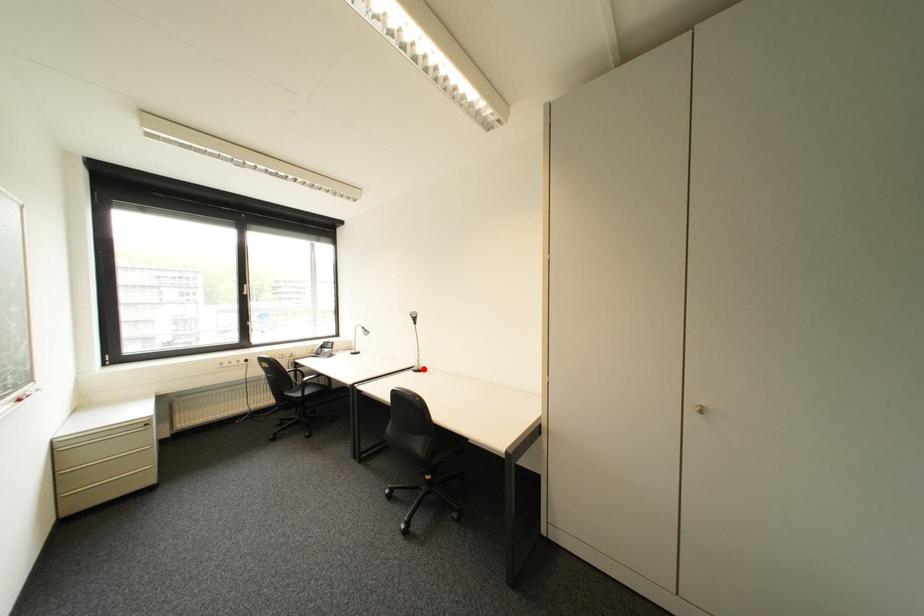
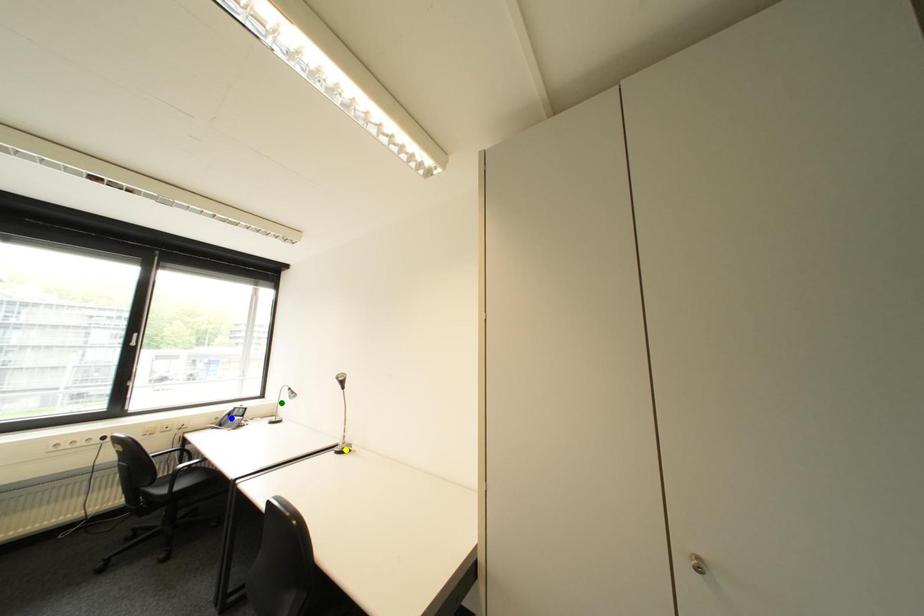
Question: I am providing you with two images of the same scene from different viewpoints. A red point is marked on the first image. You are given multiple points on the second image. Which mark in image 2 goes with the point in image 1?

Choices:
 (A) green point
 (B) yellow point
 (C) blue point

Answer: (B)